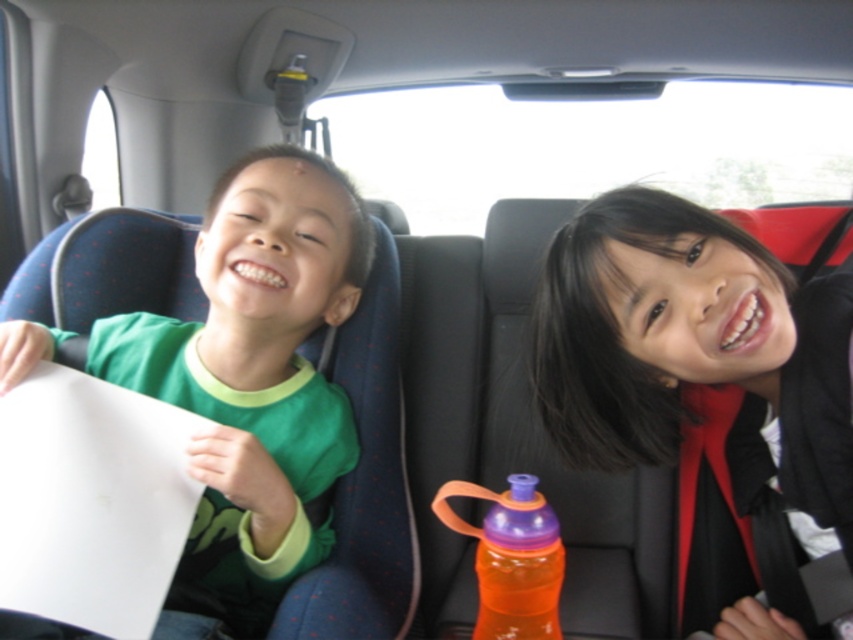
Is black fabric hair at upper right closer to camera compared to green matte shirt at left?

Yes, black fabric hair at upper right is closer to the viewer.

The height and width of the screenshot is (640, 853). Find the location of `black fabric hair at upper right`. black fabric hair at upper right is located at coordinates (704, 381).

Is black fabric hair at upper right closer to camera compared to orange plastic water bottle at center?

That is False.

Find the location of a particular element. This screenshot has height=640, width=853. black fabric hair at upper right is located at coordinates (704, 381).

Between point (49, 340) and point (469, 488), which one is positioned behind?

The point (49, 340) is behind.

Is green matte shirt at left smaller than orange plastic water bottle at center?

Incorrect, green matte shirt at left is not smaller in size than orange plastic water bottle at center.

Find the location of a particular element. This screenshot has width=853, height=640. green matte shirt at left is located at coordinates (254, 378).